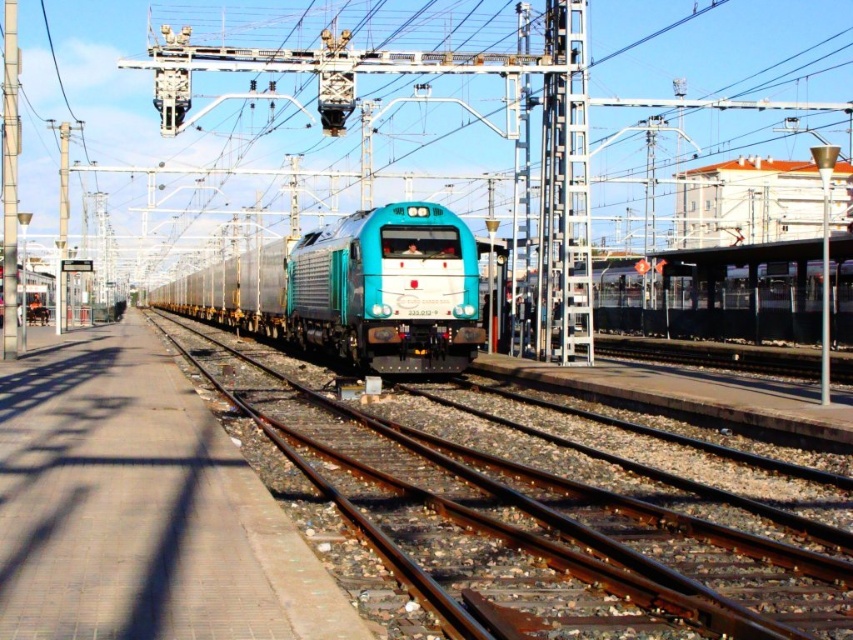
Can you confirm if brown metal train track at center is thinner than teal glossy locomotive at center?

Correct, brown metal train track at center's width is less than teal glossy locomotive at center's.

Is brown metal train track at center closer to the viewer compared to teal glossy locomotive at center?

Yes, brown metal train track at center is closer to the viewer.

Is point (465, 488) behind point (299, 284)?

That is False.

This screenshot has height=640, width=853. What are the coordinates of `brown metal train track at center` in the screenshot? It's located at (543, 525).

Who is more distant from viewer, (426,509) or (15,284)?

Point (15,284)

Between brown metal train track at center and brushed metal pole at left, which one has less height?

With less height is brown metal train track at center.

Describe the element at coordinates (543, 525) in the screenshot. I see `brown metal train track at center` at that location.

Find the location of `brown metal train track at center`. brown metal train track at center is located at coordinates (543, 525).

Is teal glossy locomotive at center above brushed metal pole at left?

Incorrect, teal glossy locomotive at center is not positioned above brushed metal pole at left.

Is point (305, 323) positioned after point (16, 68)?

Yes.

Is point (372, 342) positioned behind point (4, 211)?

No, (372, 342) is in front of (4, 211).

Find the location of a particular element. teal glossy locomotive at center is located at coordinates (354, 291).